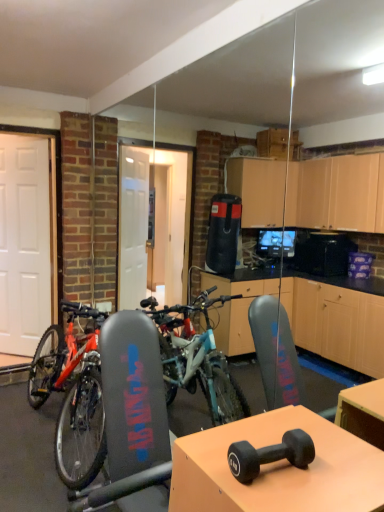
You are a GUI agent. You are given a task and a screenshot of the screen. Output one action in this format:
    pyautogui.click(x=<x>, y=<y>)
    Task: Click on the vacant space to the right of black rubber dumbbell at center
    Image resolution: width=384 pixels, height=512 pixels.
    Given the screenshot: What is the action you would take?
    pyautogui.click(x=332, y=482)